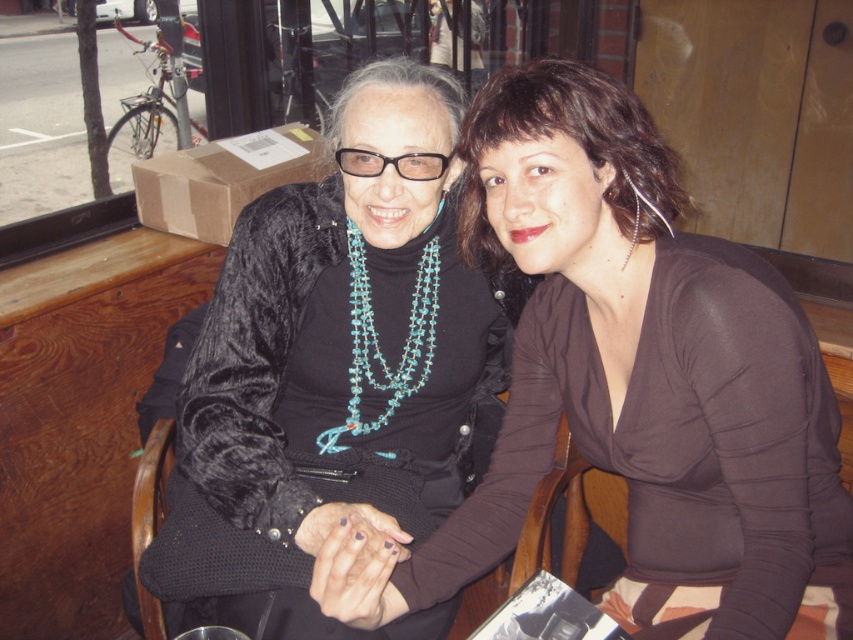
Does velvet black sweater at center have a lesser width compared to turquoise beaded necklace at center?

No, velvet black sweater at center is not thinner than turquoise beaded necklace at center.

What do you see at coordinates (344, 349) in the screenshot? I see `velvet black sweater at center` at bounding box center [344, 349].

This screenshot has width=853, height=640. Identify the location of velvet black sweater at center. (344, 349).

Is brown matte sweater at center positioned before turquoise beaded necklace at center?

That is True.

This screenshot has height=640, width=853. What are the coordinates of `brown matte sweater at center` in the screenshot? It's located at [x=639, y=381].

Who is shorter, brown matte sweater at center or velvet black sweater at center?

Standing shorter between the two is brown matte sweater at center.

What do you see at coordinates (639, 381) in the screenshot? I see `brown matte sweater at center` at bounding box center [639, 381].

The width and height of the screenshot is (853, 640). What are the coordinates of `brown matte sweater at center` in the screenshot? It's located at (639, 381).

Where is `brown matte sweater at center`? The image size is (853, 640). brown matte sweater at center is located at coordinates pyautogui.click(x=639, y=381).